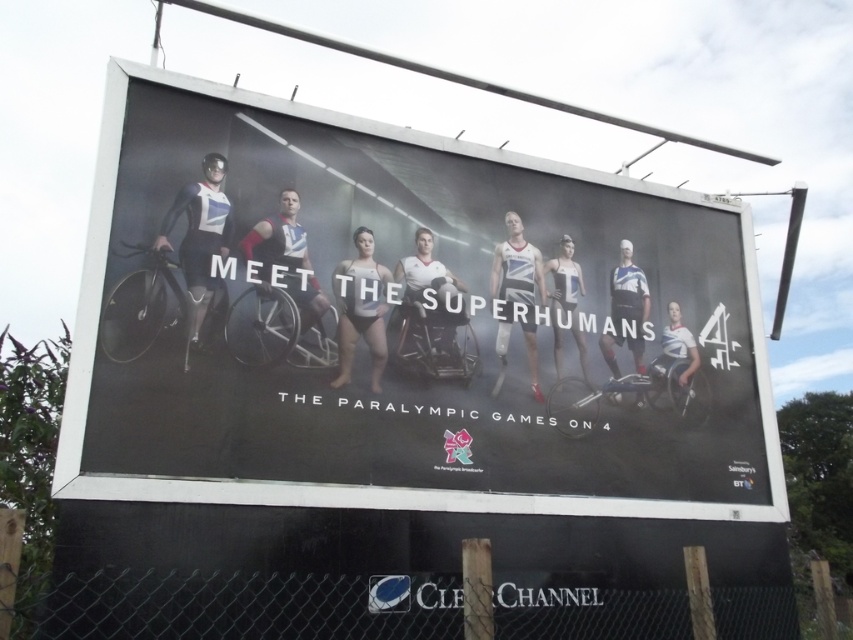
You are standing in front of the matte black billboard at center, which has a height of 3 meters. If you want to reach the top edge of the billboard to hang a banner, how high do you need to reach?

The matte black billboard at center is 2.90 meters from viewer. Since the billboard is 3 meters tall, you need to reach 2.90 meters plus half of 3 meters, totaling 4.40 meters to reach the top edge.

You are standing at the base of the Paralympic Games billboard. There is a point marked at coordinates point (207, 195) on the billboard. If you want to touch this point with a stick that is 3 meters long, will you be able to reach it?

The point (207, 195) is 3.46 meters away from you. Since the stick is only 3 meters long, you cannot reach the point with the stick.